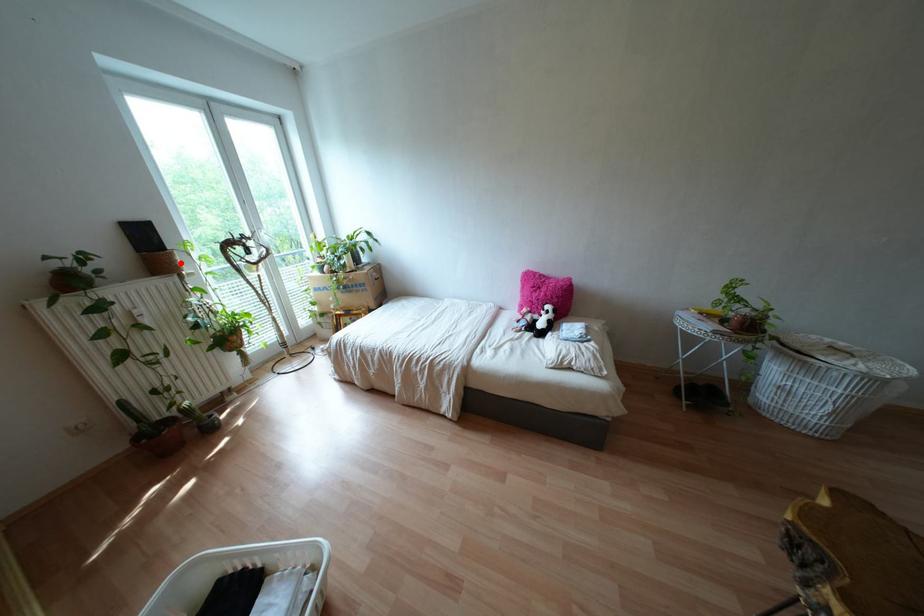
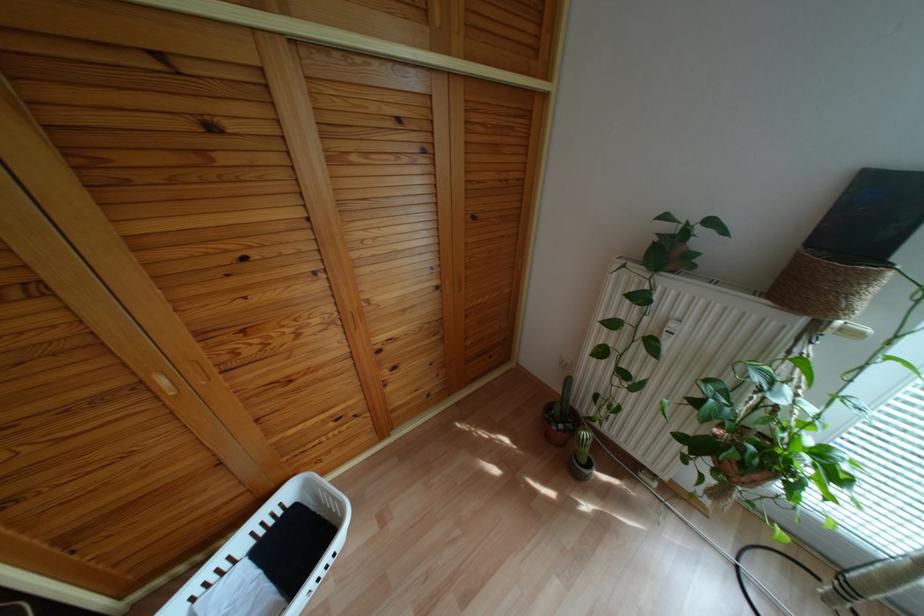
Where in the second image is the point corresponding to the highlighted location from the first image?

(861, 302)